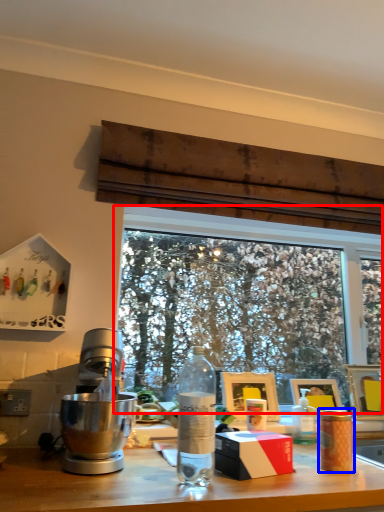
Question: Which object appears farthest to the camera in this image, window (highlighted by a red box) or coffee cup (highlighted by a blue box)?

Choices:
 (A) window
 (B) coffee cup

Answer: (A)